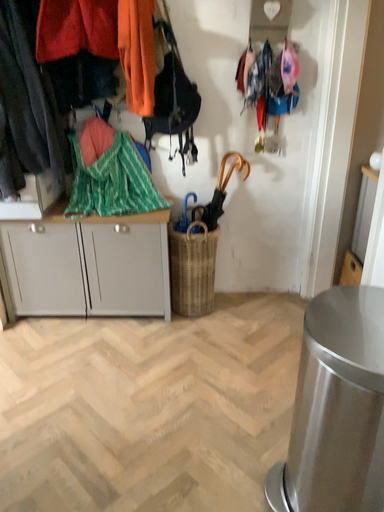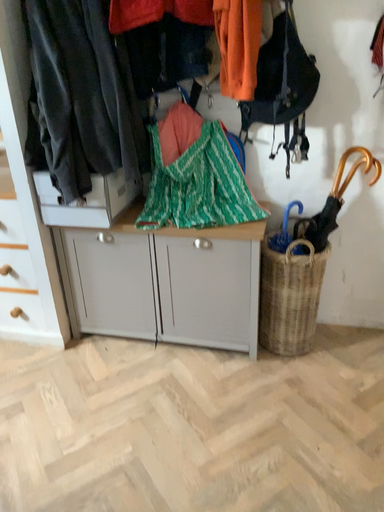
Question: How did the camera likely rotate when shooting the video?

Choices:
 (A) rotated left
 (B) rotated right

Answer: (A)